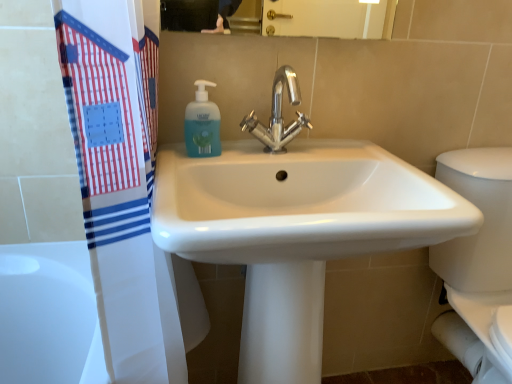
Locate an element on the screen. This screenshot has height=384, width=512. polished chrome faucet at center is located at coordinates (278, 114).

What are the coordinates of `white glossy porcelain at right` in the screenshot? It's located at [x=478, y=265].

Image resolution: width=512 pixels, height=384 pixels. What are the coordinates of `polished chrome faucet at center` in the screenshot? It's located at (278, 114).

From the image's perspective, would you say white glossy sink at center is shown under polished chrome faucet at center?

Yes.

Is white glossy sink at center smaller than polished chrome faucet at center?

No, white glossy sink at center is not smaller than polished chrome faucet at center.

Between white glossy sink at center and polished chrome faucet at center, which one has less height?

polished chrome faucet at center is shorter.

How different are the orientations of white glossy sink at center and polished chrome faucet at center in degrees?

There is a 0.000303-degree angle between the facing directions of white glossy sink at center and polished chrome faucet at center.

From the image's perspective, is translucent plastic soap dispenser at upper center located above polished chrome faucet at center?

Correct, translucent plastic soap dispenser at upper center appears higher than polished chrome faucet at center in the image.

Is point (219, 131) closer or farther from the camera than point (288, 88)?

Point (219, 131) is closer to the camera than point (288, 88).

Is translucent plastic soap dispenser at upper center oriented towards polished chrome faucet at center?

No, translucent plastic soap dispenser at upper center is not aimed at polished chrome faucet at center.

Looking at their sizes, would you say translucent plastic soap dispenser at upper center is wider or thinner than white glossy porcelain at right?

In the image, translucent plastic soap dispenser at upper center appears to be more narrow than white glossy porcelain at right.

From a real-world perspective, is translucent plastic soap dispenser at upper center located higher than white glossy porcelain at right?

Yes, from a real-world perspective, translucent plastic soap dispenser at upper center is on top of white glossy porcelain at right.

Is translucent plastic soap dispenser at upper center situated inside white glossy porcelain at right or outside?

translucent plastic soap dispenser at upper center lies outside white glossy porcelain at right.

Is translucent plastic soap dispenser at upper center aimed at white glossy porcelain at right?

No, translucent plastic soap dispenser at upper center does not turn towards white glossy porcelain at right.

Is polished chrome faucet at center aimed at white glossy sink at center?

No.

Would you say polished chrome faucet at center is a long distance from white glossy sink at center?

Actually, polished chrome faucet at center and white glossy sink at center are a little close together.

Considering the relative positions of polished chrome faucet at center and white glossy sink at center in the image provided, is polished chrome faucet at center to the left of white glossy sink at center from the viewer's perspective?

Incorrect, polished chrome faucet at center is not on the left side of white glossy sink at center.

How far apart are polished chrome faucet at center and white glossy sink at center?

polished chrome faucet at center is 8.96 inches away from white glossy sink at center.

From a real-world perspective, which object rests below the other?

white glossy porcelain at right, from a real-world perspective.

Which is in front, white glossy sink at center or white glossy porcelain at right?

white glossy sink at center.

From the image's perspective, would you say white glossy sink at center is shown under white glossy porcelain at right?

Yes.

Considering the sizes of white glossy sink at center and white glossy porcelain at right in the image, is white glossy sink at center bigger or smaller than white glossy porcelain at right?

In the image, white glossy sink at center appears to be larger than white glossy porcelain at right.

From the image's perspective, is polished chrome faucet at center positioned above or below white glossy porcelain at right?

polished chrome faucet at center is situated higher than white glossy porcelain at right in the image.

How many degrees apart are the facing directions of polished chrome faucet at center and white glossy porcelain at right?

1.53 degrees.

From a real-world perspective, is polished chrome faucet at center physically located above or below white glossy porcelain at right?

In terms of real-world spatial position, polished chrome faucet at center is above white glossy porcelain at right.

Is polished chrome faucet at center in contact with white glossy porcelain at right?

No, polished chrome faucet at center is not with white glossy porcelain at right.

Does white glossy porcelain at right have a smaller size compared to white glossy sink at center?

Yes.

Is point (449, 178) positioned after point (316, 354)?

Yes.

Who is shorter, white glossy porcelain at right or white glossy sink at center?

Standing shorter between the two is white glossy porcelain at right.

At what (x,y) coordinates should I click in order to perform the action: click on tap behind the white glossy sink at center. Please return your answer as a coordinate pair (x, y). The width and height of the screenshot is (512, 384). Looking at the image, I should click on point(278,114).

Locate an element on the screen. soap dispenser above the polished chrome faucet at center (from the image's perspective) is located at coordinates (202, 124).

When comparing their distances from translucent plastic soap dispenser at upper center, does polished chrome faucet at center or white glossy sink at center seem further?

white glossy sink at center.

Looking at the image, which one is located further to translucent plastic soap dispenser at upper center, white glossy porcelain at right or polished chrome faucet at center?

white glossy porcelain at right.

From the image, which object appears to be farther from white glossy porcelain at right, polished chrome faucet at center or translucent plastic soap dispenser at upper center?

Among the two, translucent plastic soap dispenser at upper center is located further to white glossy porcelain at right.

Considering their positions, is polished chrome faucet at center positioned closer to white glossy porcelain at right than white glossy sink at center?

white glossy sink at center.

Estimate the real-world distances between objects in this image. Which object is closer to translucent plastic soap dispenser at upper center, white glossy sink at center or polished chrome faucet at center?

polished chrome faucet at center is closer to translucent plastic soap dispenser at upper center.

Looking at the image, which one is located closer to white glossy porcelain at right, translucent plastic soap dispenser at upper center or polished chrome faucet at center?

polished chrome faucet at center lies closer to white glossy porcelain at right than the other object.

From the image, which object appears to be farther from white glossy sink at center, white glossy porcelain at right or translucent plastic soap dispenser at upper center?

Among the two, white glossy porcelain at right is located further to white glossy sink at center.

From the image, which object appears to be farther from white glossy sink at center, polished chrome faucet at center or white glossy porcelain at right?

white glossy porcelain at right.

The image size is (512, 384). Identify the location of tap between translucent plastic soap dispenser at upper center and white glossy porcelain at right. (278, 114).

Identify the location of sink between translucent plastic soap dispenser at upper center and white glossy porcelain at right from left to right. The width and height of the screenshot is (512, 384). (295, 225).

Locate an element on the screen. tap between white glossy sink at center and white glossy porcelain at right is located at coordinates (278, 114).

Identify the location of tap between translucent plastic soap dispenser at upper center and white glossy sink at center from top to bottom. This screenshot has width=512, height=384. (278, 114).